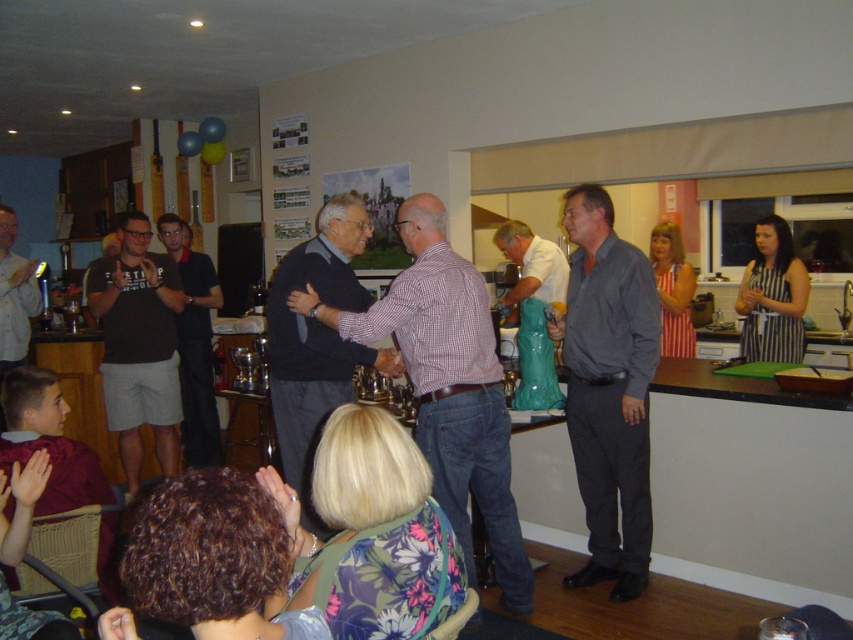
You are a photographer at the event and need to capture a photo that includes both the dark gray sweater at center and the light brown shirt at lower left. Which object should you position closer to the camera to ensure both are fully visible in the frame?

Since the dark gray sweater at center is much taller than the light brown shirt at lower left, you should position the light brown shirt at lower left closer to the camera to ensure both are fully visible in the frame.